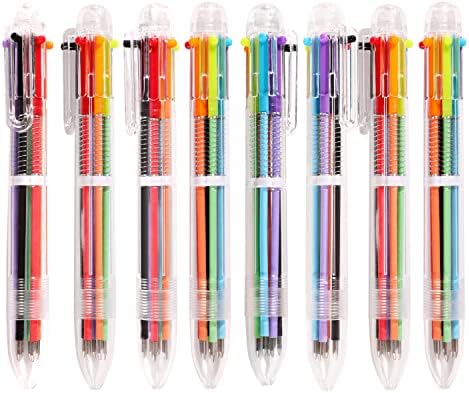
The width and height of the screenshot is (469, 393). What are the coordinates of `multi-colored pens` in the screenshot? It's located at (30, 157), (98, 157), (158, 159), (212, 163), (269, 162), (326, 157), (389, 160), (446, 162).